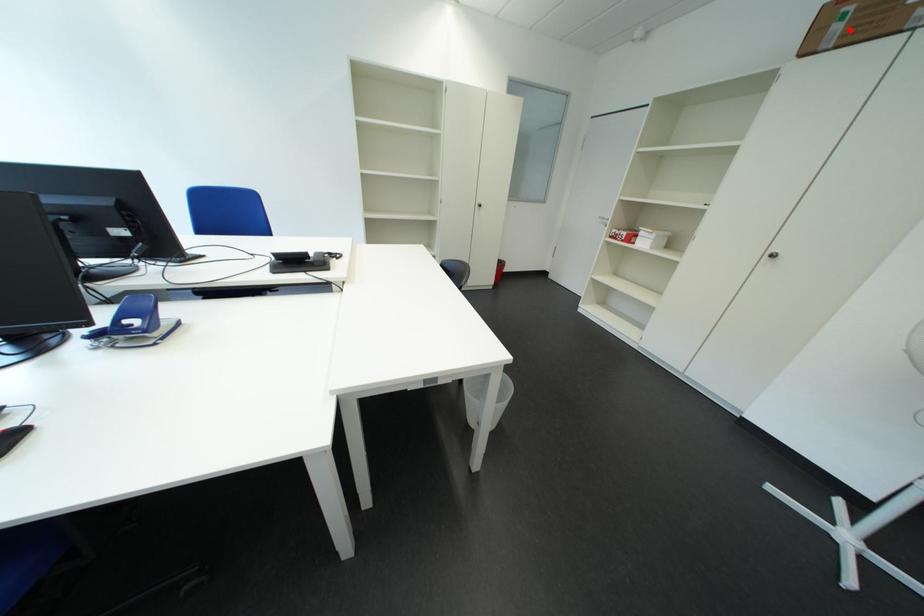
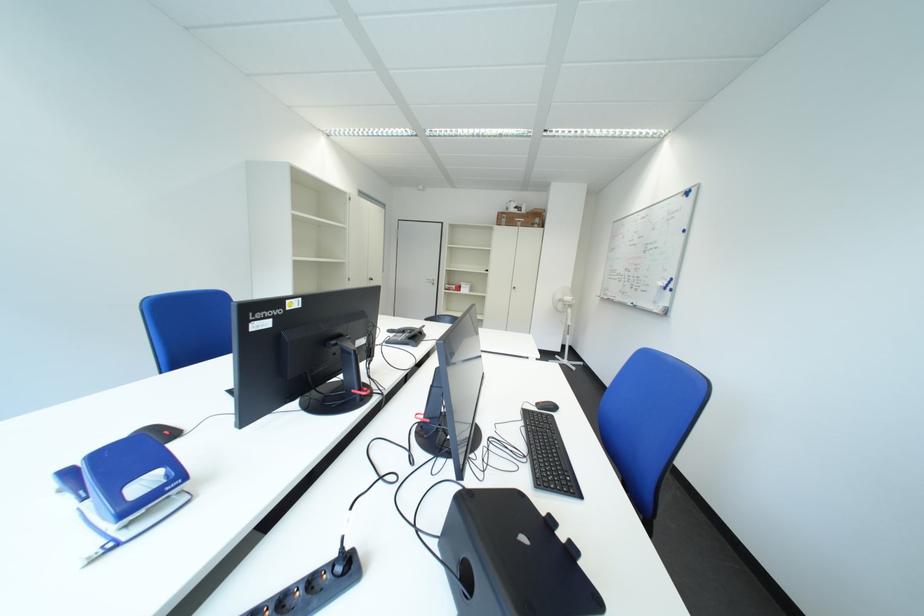
Question: I am providing you with two images of the same scene from different viewpoints. Given a red point in image1, look at the same physical point in image2. Is it:

Choices:
 (A) Closer to the viewpoint
 (B) Farther from the viewpoint

Answer: (A)